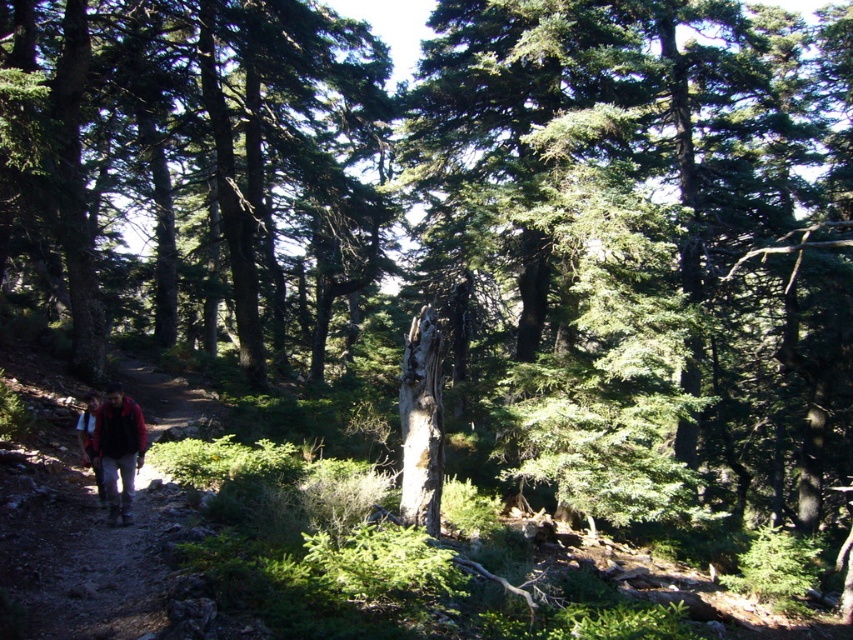
You are a hiker standing at the dirt path at lower left in the forest. You want to reach the nearest tree. Which direction should you walk to get there?

The dirt path at lower left is located at point (80, 541). Since the nearest tree would be in the direction away from the path towards the dense forest area, you should walk towards the upper right direction to reach the nearest tree.

You are a hiker who wants to take a photo of the green rough bark tree at center and the red plaid shirt at lower left. Can you fit both in the frame of your camera if the maximum distance your camera can capture in a single shot is 60 feet?

The green rough bark tree at center and red plaid shirt at lower left are 68.47 feet apart, which exceeds the camera maximum distance of 60 feet. Therefore, you cannot fit both in the frame.

You are a hiker standing at the lower left of the image. You see a dirt path at lower left and a red plaid shirt at lower left. Which object is higher in elevation?

The dirt path at lower left has a greater height compared to the red plaid shirt at lower left, so the dirt path at lower left is higher in elevation.